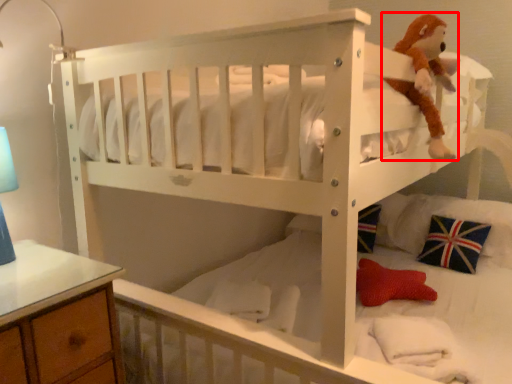
Question: Where is toy (annotated by the red box) located in relation to pillow in the image?

Choices:
 (A) left
 (B) right

Answer: (A)